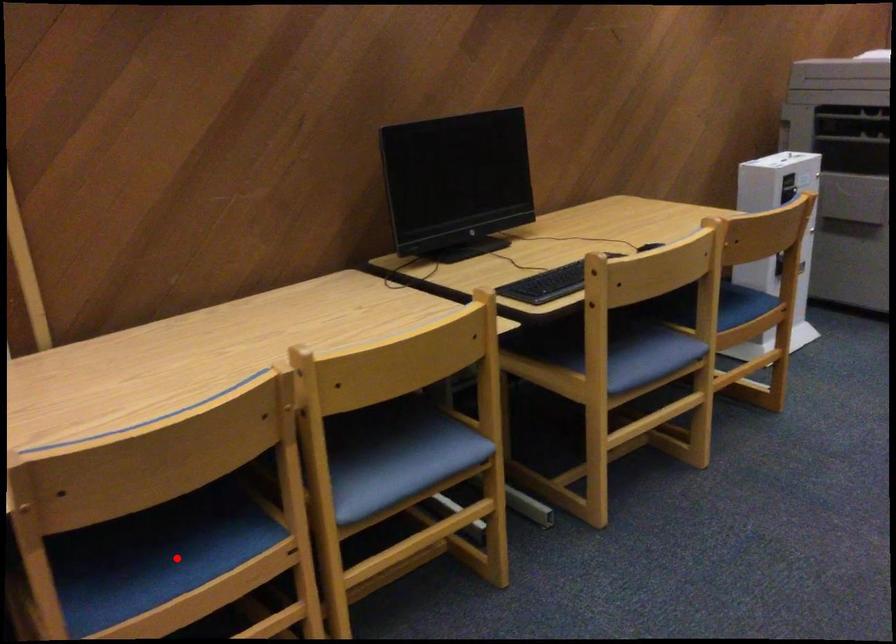
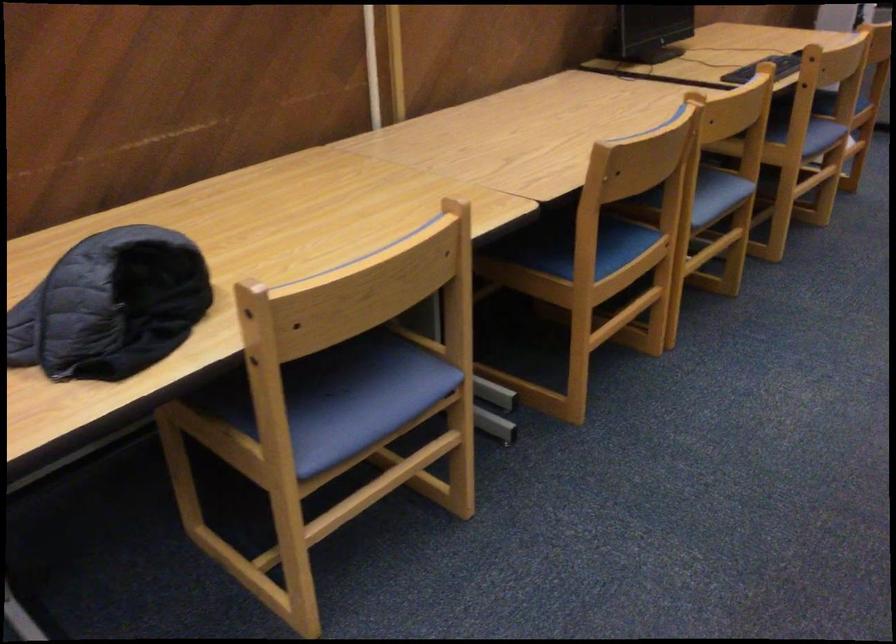
Question: I am providing you with two images of the same scene from different viewpoints. A red point is shown in image1. For the corresponding object point in image2, is it positioned nearer or farther from the camera?

Choices:
 (A) Nearer
 (B) Farther

Answer: (B)